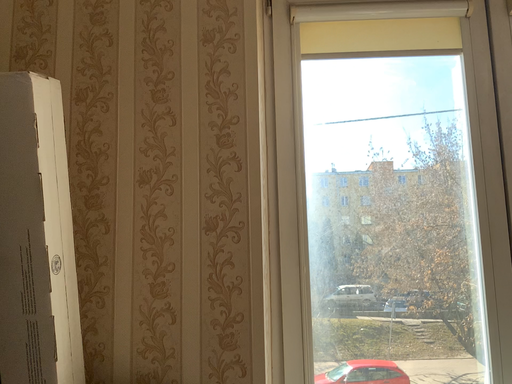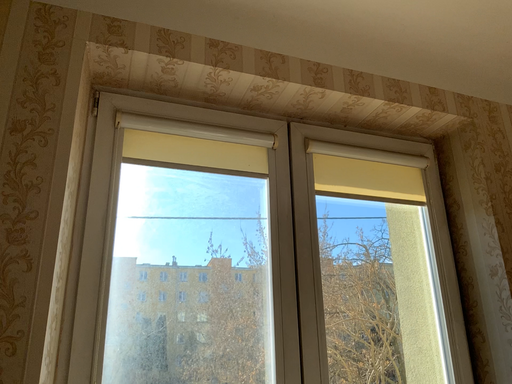
Question: How did the camera likely rotate when shooting the video?

Choices:
 (A) rotated downward
 (B) rotated upward

Answer: (B)